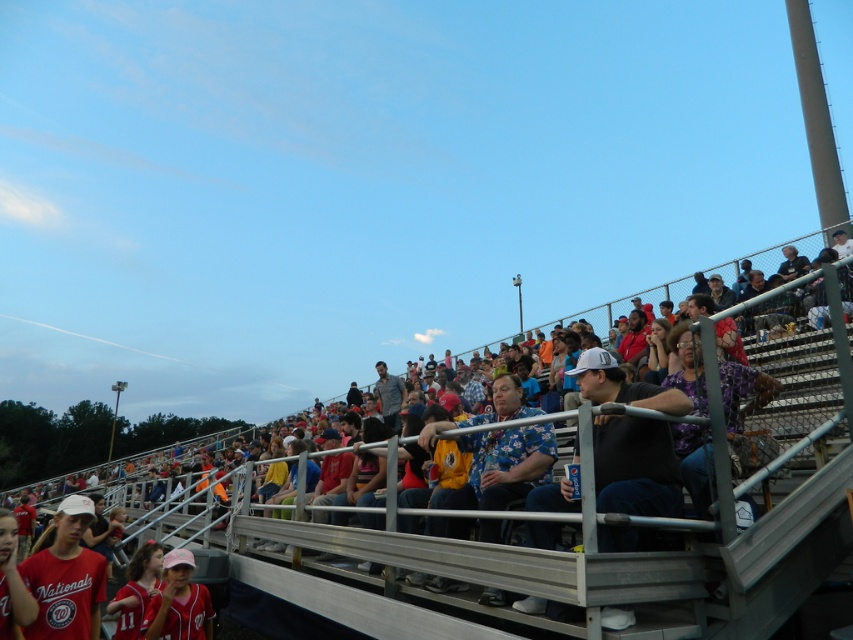
You are a spectator at the baseball stadium and want to find your seat. You see the blue fabric seats at center and the matte red jersey at lower left. Which object is located above the other?

The blue fabric seats at center is positioned under matte red jersey at lower left, so the matte red jersey at lower left is above the blue fabric seats at center.

You are a photographer trying to capture a closeup of the matte pink cap at lower center without blocking the blue fabric seats at center. Which object should you move closer to?

To capture a closeup of the matte pink cap at lower center without blocking the blue fabric seats at center, you should move closer to the matte pink cap at lower center since it is smaller and might be narrower than the blue fabric seats at center.

You are sitting in the bleachers at the baseball stadium and want to wave to a friend who is standing at point (202, 589). There is another person waving at point (33, 580). Which person is closer to you?

The person at point (33, 580) is closer to you because the Objects Description states that point (33, 580) is closer to the viewer than point (202, 589).